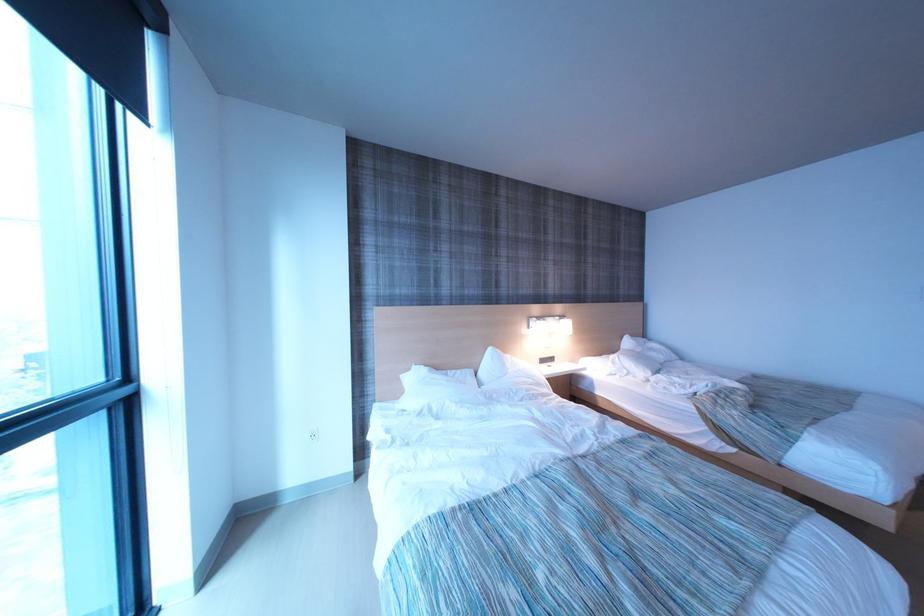
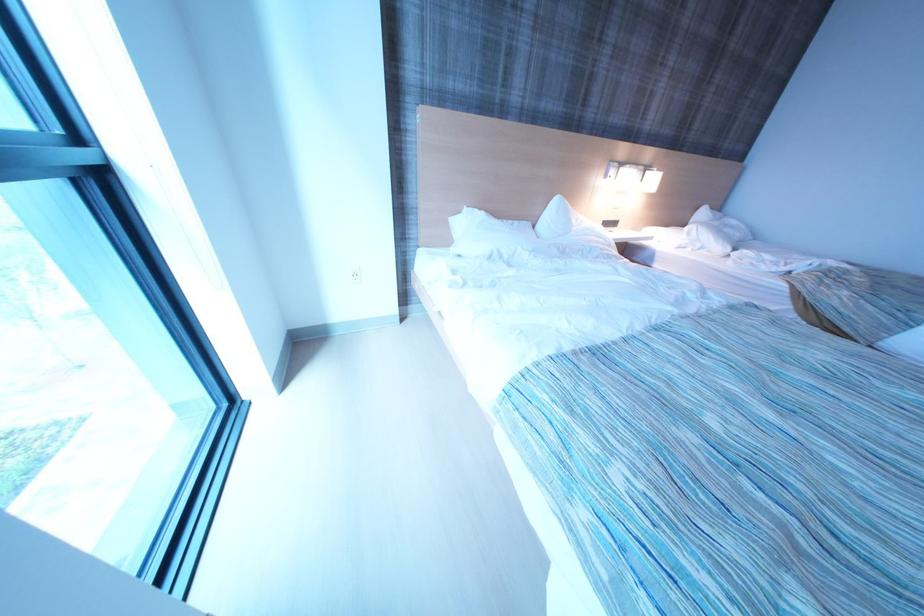
Question: How did the camera likely rotate?

Choices:
 (A) Left
 (B) Right
 (C) Up
 (D) Down

Answer: (D)